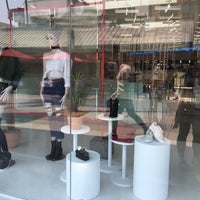
Where is `shoe`? The image size is (200, 200). shoe is located at coordinates (80, 164).